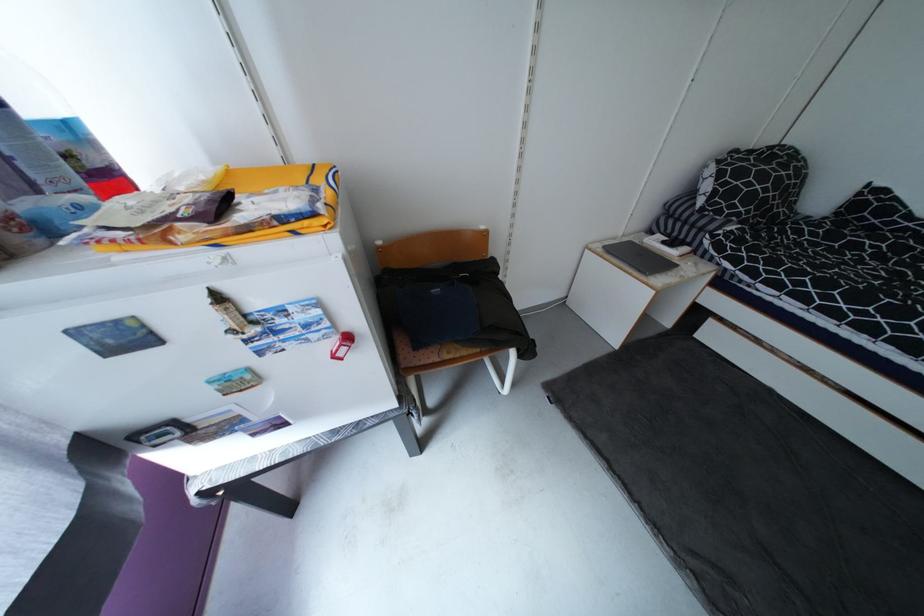
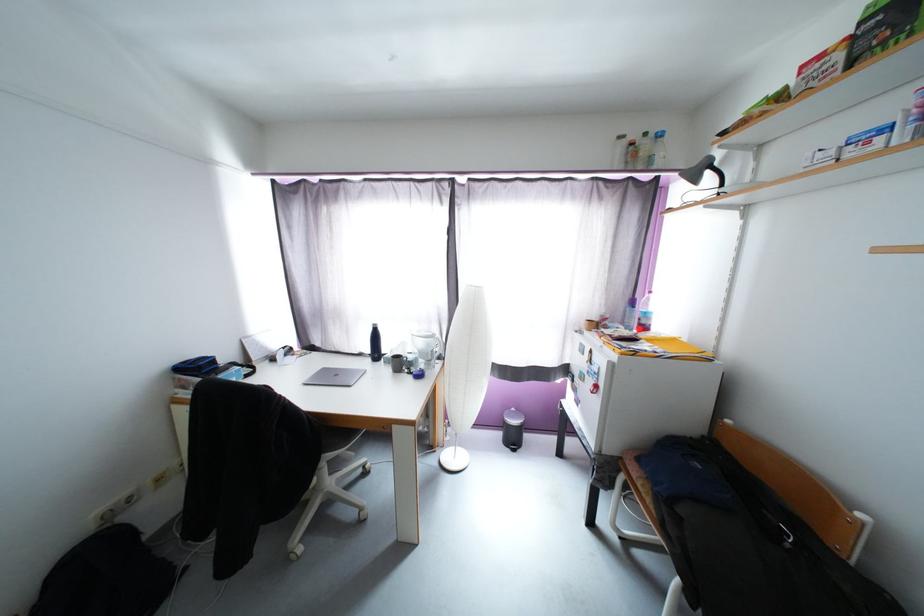
Where in the second image is the point corresponding to point (79, 132) from the first image?

(651, 315)